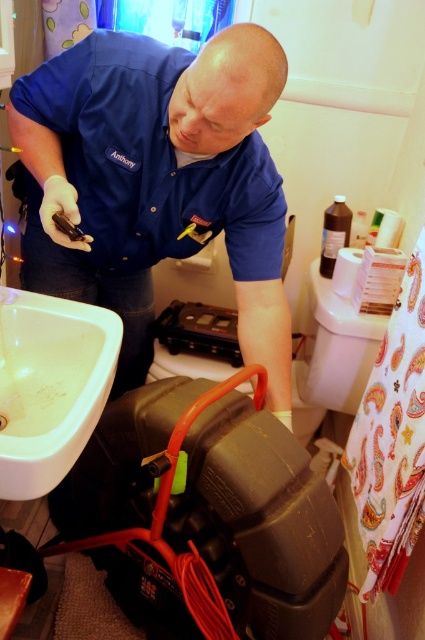
Question: From the image, what is the correct spatial relationship of blue uniform shirt at upper center in relation to white glossy sink at lower left?

Choices:
 (A) above
 (B) below

Answer: (A)

Question: Which point is closer to the camera taking this photo?

Choices:
 (A) (56, 481)
 (B) (181, 83)

Answer: (A)

Question: Among these objects, which one is farthest from the camera?

Choices:
 (A) white glossy sink at lower left
 (B) blue uniform shirt at upper center

Answer: (B)

Question: Can you confirm if blue uniform shirt at upper center is positioned to the right of white glossy sink at lower left?

Choices:
 (A) no
 (B) yes

Answer: (B)

Question: Does blue uniform shirt at upper center have a smaller size compared to white glossy sink at lower left?

Choices:
 (A) no
 (B) yes

Answer: (A)